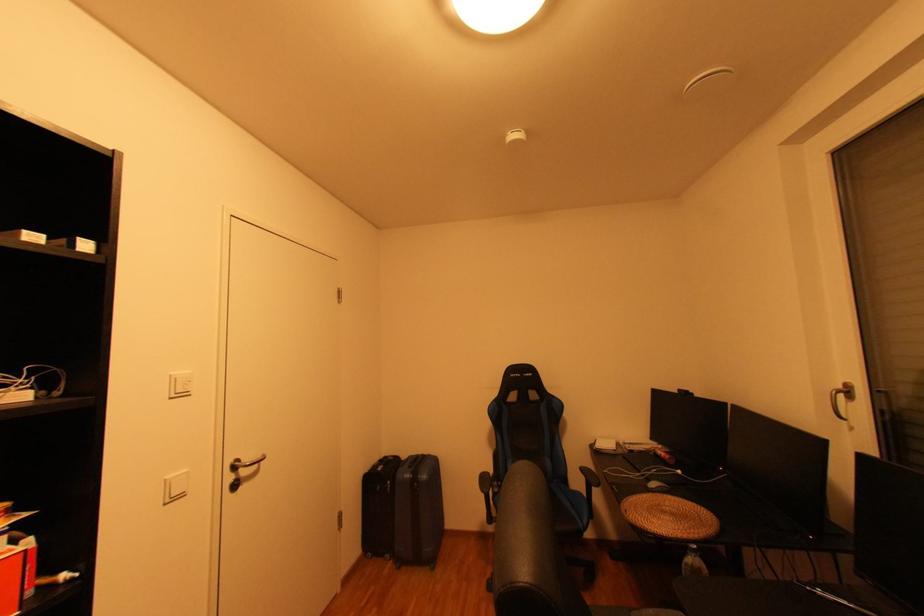
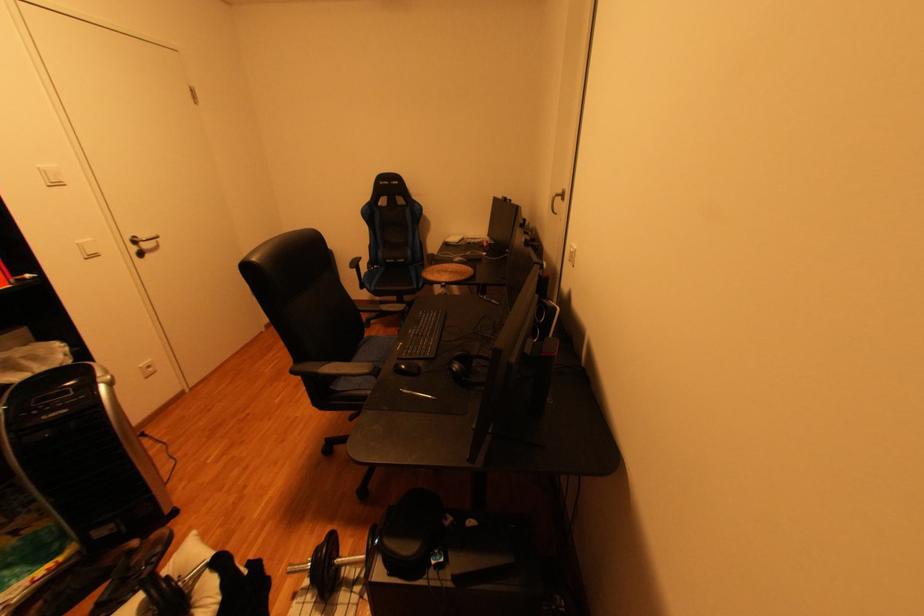
Locate, in the second image, the point that corresponds to (177,477) in the first image.

(89, 243)